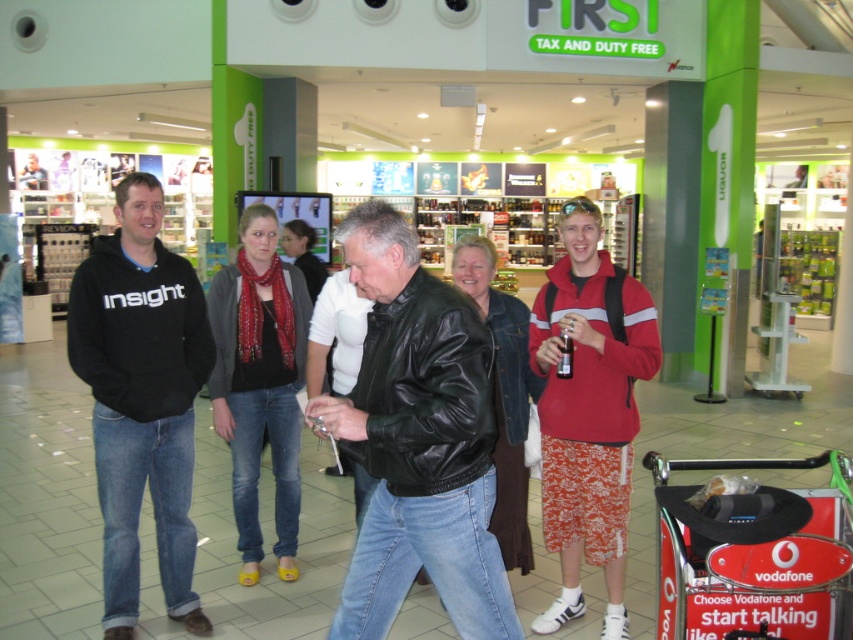
You are standing in the duty free shop and need to hand a brochure to the person wearing the black leather jacket at center and the person wearing the black hoodie at left. Which one should you approach first to ensure you can reach both without moving from your current spot?

You should approach the black leather jacket at center first because it is closer to you than the black hoodie at left, so you can reach them without moving from your current spot.

You are a store employee who needs to arrange the black hoodie at left and the red polyester hoodie at center on a shelf. The shelf has a height limit of 1 meter. Can both hoodies be placed on the shelf without exceeding the height limit?

The black hoodie at left is much taller than the red polyester hoodie at center. Since the shelf has a height limit of 1 meter, both hoodies can be placed on the shelf as the height of the black hoodie at left alone must be under 1 meter to comply with the limit.